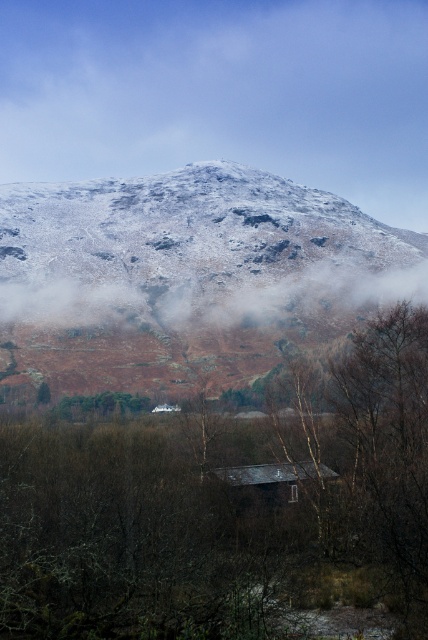
Who is shorter, snowy rock mountain at upper center or foggy mist at center?

foggy mist at center

Between point (205, 216) and point (418, 294), which one is positioned in front?

Positioned in front is point (418, 294).

Identify the location of snowy rock mountain at upper center. The width and height of the screenshot is (428, 640). (177, 276).

Looking at this image, does brown matte tree at lower center lie in front of snowy rock mountain at upper center?

Yes.

Who is more forward, (110, 595) or (154, 296)?

Point (110, 595) is in front.

What are the coordinates of `brown matte tree at lower center` in the screenshot? It's located at (223, 504).

Can you confirm if snowy rock mountain at upper center is positioned above dark brown wooden hut at center?

Yes, snowy rock mountain at upper center is above dark brown wooden hut at center.

Can you confirm if snowy rock mountain at upper center is wider than dark brown wooden hut at center?

Indeed, snowy rock mountain at upper center has a greater width compared to dark brown wooden hut at center.

Between point (35, 237) and point (317, 477), which one is positioned behind?

The point (35, 237) is more distant.

Where is `snowy rock mountain at upper center`? This screenshot has width=428, height=640. snowy rock mountain at upper center is located at coordinates (177, 276).